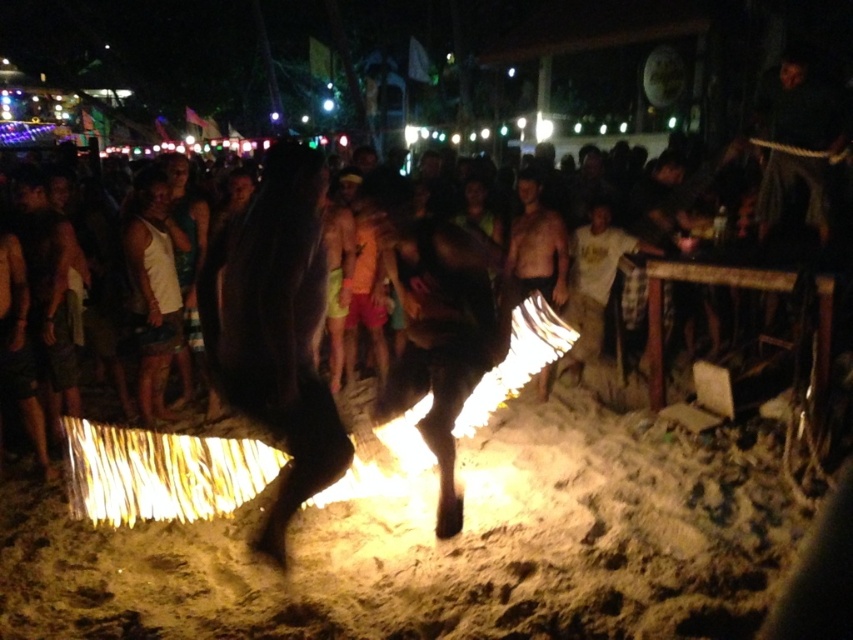
Question: Which object appears closest to the camera in this image?

Choices:
 (A) white cotton shirt at center
 (B) shiny black skin at center

Answer: (B)

Question: Is white cotton shirt at center thinner than shiny black skin at center?

Choices:
 (A) yes
 (B) no

Answer: (B)

Question: Can you confirm if white cotton shirt at center is smaller than shiny black skin at center?

Choices:
 (A) no
 (B) yes

Answer: (A)

Question: Can you confirm if white cotton shirt at center is positioned to the left of shiny black skin at center?

Choices:
 (A) yes
 (B) no

Answer: (B)